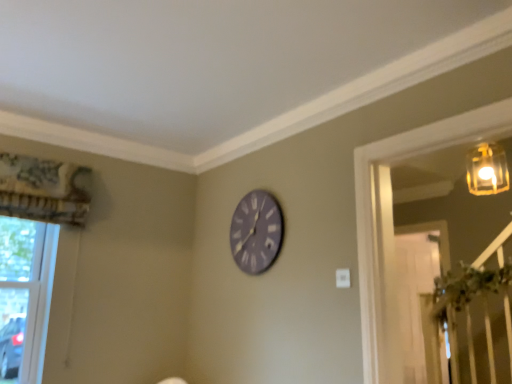
The width and height of the screenshot is (512, 384). What do you see at coordinates (256, 232) in the screenshot? I see `matte gray clock at center` at bounding box center [256, 232].

Looking at this image, measure the distance between point (264, 206) and camera.

The depth of point (264, 206) is 8.17 feet.

Where is `matte gray clock at center`? matte gray clock at center is located at coordinates (256, 232).

What do you see at coordinates (25, 296) in the screenshot? The image size is (512, 384). I see `clear glass window at lower left` at bounding box center [25, 296].

What is the approximate width of clear glass window at lower left?

It is 3.41 inches.

What are the coordinates of `clear glass window at lower left` in the screenshot? It's located at (25, 296).

Find the location of a particular element. matte gray clock at center is located at coordinates (256, 232).

Does clear glass window at lower left appear on the left side of matte gray clock at center?

Yes, clear glass window at lower left is to the left of matte gray clock at center.

Considering the relative positions of clear glass window at lower left and matte gray clock at center in the image provided, is clear glass window at lower left in front of matte gray clock at center?

Yes, clear glass window at lower left is in front of matte gray clock at center.

Considering the points (28, 274) and (271, 254), which point is behind, point (28, 274) or point (271, 254)?

The point (28, 274) is more distant.

From the image's perspective, which object appears higher, clear glass window at lower left or matte gray clock at center?

matte gray clock at center.

From a real-world perspective, is clear glass window at lower left beneath matte gray clock at center?

Yes, from a real-world perspective, clear glass window at lower left is under matte gray clock at center.

Considering the sizes of objects clear glass window at lower left and matte gray clock at center in the image provided, who is wider, clear glass window at lower left or matte gray clock at center?

clear glass window at lower left.

Who is taller, clear glass window at lower left or matte gray clock at center?

Standing taller between the two is clear glass window at lower left.

Which of these two, clear glass window at lower left or matte gray clock at center, is bigger?

clear glass window at lower left is bigger.

Would you say clear glass window at lower left is inside or outside matte gray clock at center?

clear glass window at lower left exists outside the volume of matte gray clock at center.

Are clear glass window at lower left and matte gray clock at center located far from each other?

Yes.

Does clear glass window at lower left turn towards matte gray clock at center?

No.

How many degrees apart are the facing directions of clear glass window at lower left and matte gray clock at center?

92 degrees separate the facing orientations of clear glass window at lower left and matte gray clock at center.

Where is `window located underneath the matte gray clock at center (from a real-world perspective)`? window located underneath the matte gray clock at center (from a real-world perspective) is located at coordinates (25, 296).

Is matte gray clock at center to the left of clear glass window at lower left from the viewer's perspective?

No, matte gray clock at center is not to the left of clear glass window at lower left.

Based on the photo, who is more distant, matte gray clock at center or clear glass window at lower left?

Positioned behind is matte gray clock at center.

Is point (246, 244) positioned in front of point (58, 235)?

Yes.

From the image's perspective, relative to clear glass window at lower left, is matte gray clock at center above or below?

matte gray clock at center is above clear glass window at lower left.

From a real-world perspective, which is physically above, matte gray clock at center or clear glass window at lower left?

matte gray clock at center.

Which object is wider, matte gray clock at center or clear glass window at lower left?

Wider between the two is clear glass window at lower left.

Is matte gray clock at center taller than clear glass window at lower left?

No.

Considering the sizes of objects matte gray clock at center and clear glass window at lower left in the image provided, who is bigger, matte gray clock at center or clear glass window at lower left?

clear glass window at lower left.

Is clear glass window at lower left a part of matte gray clock at center?

No, clear glass window at lower left is not surrounded by matte gray clock at center.

Is matte gray clock at center placed right next to clear glass window at lower left?

No, matte gray clock at center is not next to clear glass window at lower left.

Is matte gray clock at center aimed at clear glass window at lower left?

No, matte gray clock at center is not aimed at clear glass window at lower left.

How much distance is there between matte gray clock at center and clear glass window at lower left?

1.26 meters.

Identify the location of window lying below the matte gray clock at center (from the image's perspective). The image size is (512, 384). (25, 296).

Locate an element on the screen. wall clock on the right of clear glass window at lower left is located at coordinates (256, 232).

You are a GUI agent. You are given a task and a screenshot of the screen. Output one action in this format:
    pyautogui.click(x=<x>, y=<y>)
    Task: Click on the window below the matte gray clock at center (from the image's perspective)
    This screenshot has width=512, height=384.
    Given the screenshot: What is the action you would take?
    pyautogui.click(x=25, y=296)